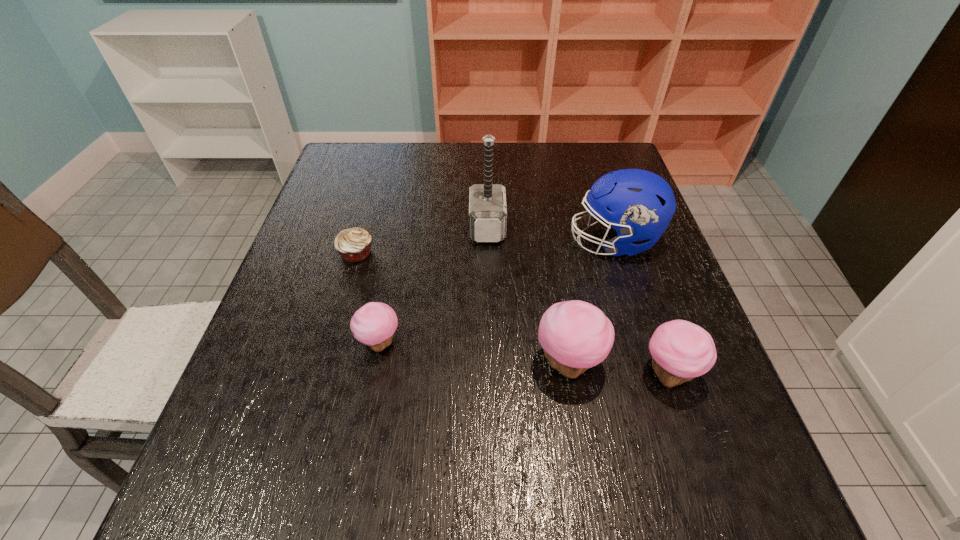
The height and width of the screenshot is (540, 960). Identify the location of the second shortest object. click(374, 324).

At what (x,y) coordinates should I click in order to perform the action: click on the leftmost cupcake. Please return your answer as a coordinate pair (x, y). Looking at the image, I should click on (374, 324).

Locate an element on the screen. the tallest cupcake is located at coordinates (575, 335).

Identify the location of the third tallest object. (x=575, y=335).

Find the location of a particular element. The image size is (960, 540). the rightmost cupcake is located at coordinates (680, 350).

The image size is (960, 540). Find the location of `the second shortest cupcake`. the second shortest cupcake is located at coordinates (680, 350).

Where is `the leftmost object`? the leftmost object is located at coordinates (354, 244).

I want to click on the shortest object, so pyautogui.click(x=354, y=244).

Identify the location of hammer. Image resolution: width=960 pixels, height=540 pixels. (487, 202).

In order to click on the third object from left to right in this screenshot , I will do `click(487, 202)`.